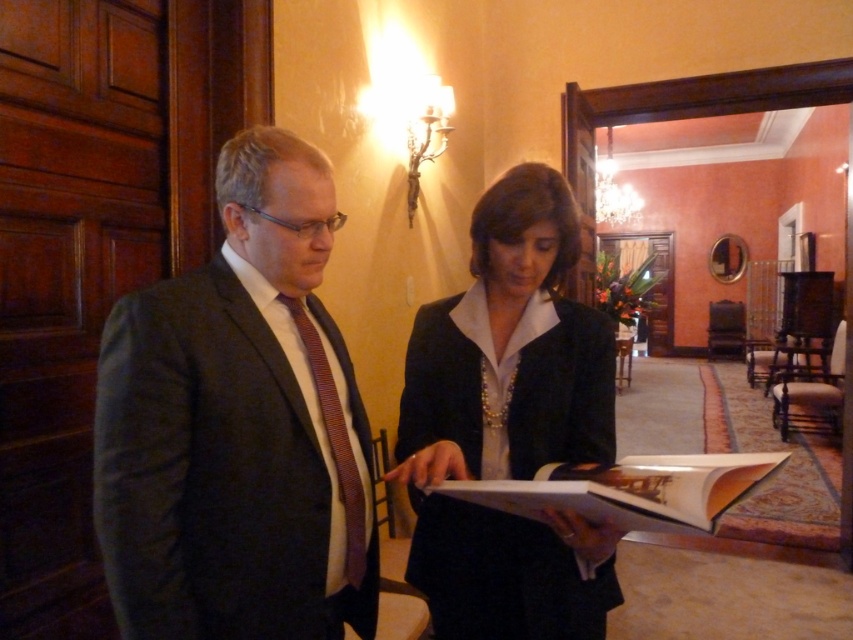
Question: Is matte black blazer at center further to camera compared to striped silk tie at left?

Choices:
 (A) no
 (B) yes

Answer: (A)

Question: Which of the following is the farthest from the observer?

Choices:
 (A) (358, 502)
 (B) (532, 512)

Answer: (A)

Question: Which object appears farthest from the camera in this image?

Choices:
 (A) matte black blazer at center
 (B) dark gray suit at center
 (C) striped silk tie at left

Answer: (C)

Question: Is dark gray suit at center to the right of matte black blazer at center from the viewer's perspective?

Choices:
 (A) no
 (B) yes

Answer: (A)

Question: Which object is closer to the camera taking this photo?

Choices:
 (A) striped silk tie at left
 (B) dark gray suit at center

Answer: (B)

Question: Is matte black blazer at center below white paper book at center?

Choices:
 (A) no
 (B) yes

Answer: (A)